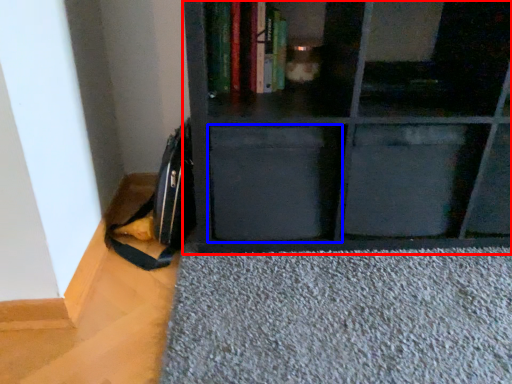
Question: Which object is closer to the camera taking this photo, shelf (highlighted by a red box) or drawer (highlighted by a blue box)?

Choices:
 (A) shelf
 (B) drawer

Answer: (A)